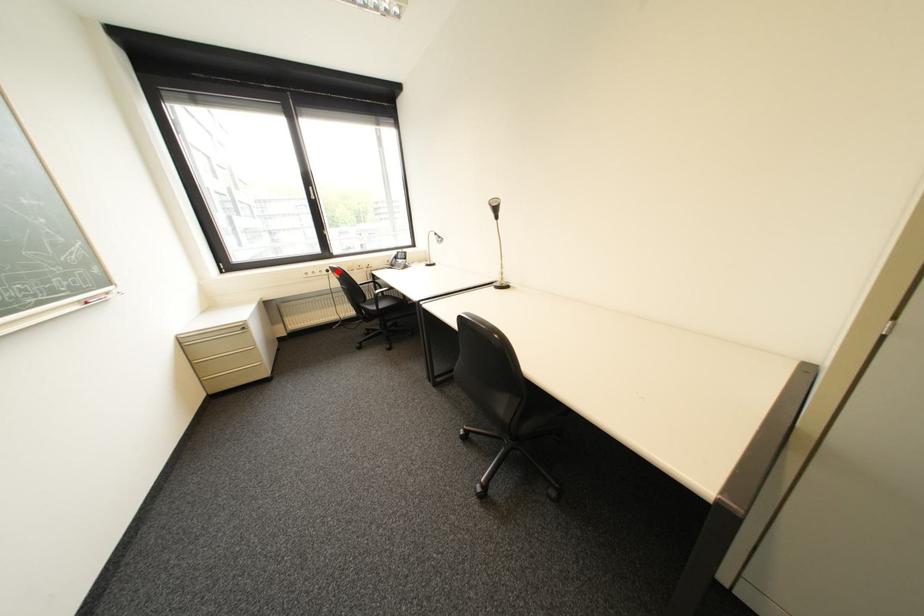
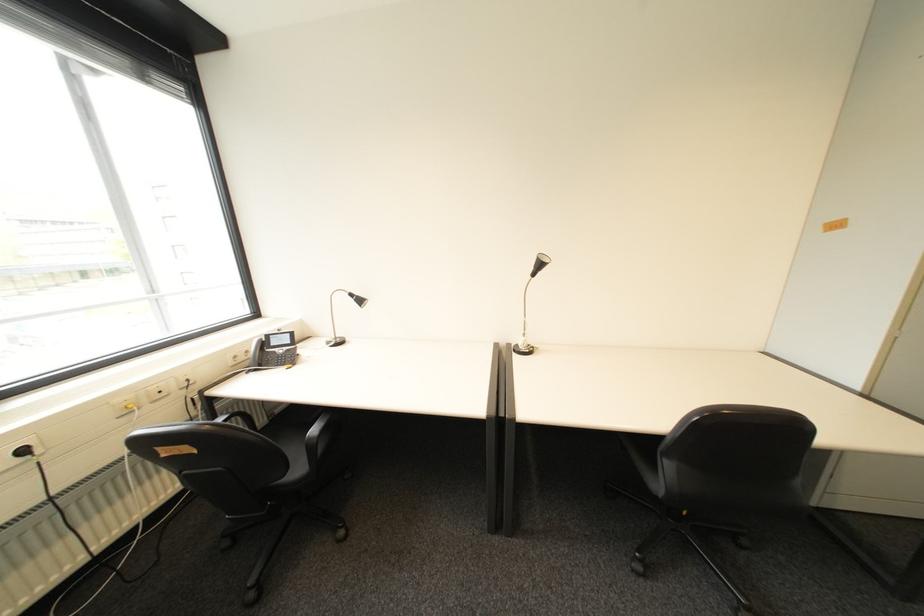
Question: I am providing you with two images of the same scene from different viewpoints. A red point is shown in image1. For the corresponding object point in image2, is it positioned nearer or farther from the camera?

Choices:
 (A) Nearer
 (B) Farther

Answer: (B)